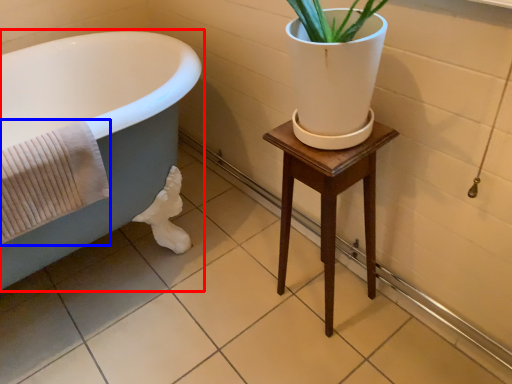
Question: Which object is further to the camera taking this photo, bathtub (highlighted by a red box) or bath towel (highlighted by a blue box)?

Choices:
 (A) bathtub
 (B) bath towel

Answer: (B)